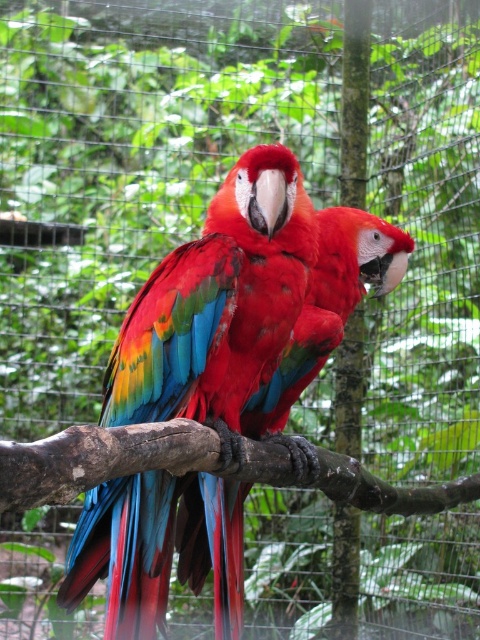
You are a zookeeper trying to determine if a new feeding tray can fit between the glossy feathers parrot at center and the brown rough tree branch at center. The feeding tray is 10 cm wide. Can you fit it there?

The glossy feathers parrot at center has a lesser width compared to brown rough tree branch at center. Since the parrot is narrower, the space between them may accommodate the 10 cm feeding tray, but exact placement depends on their positioning.

You are a zookeeper observing the aviary. You notice the glossy feathers parrot at center and the brown rough tree branch at center. Which object is positioned higher in the image?

The glossy feathers parrot at center is located above the brown rough tree branch at center, so it is positioned higher in the image.

Consider the image. You are a zookeeper observing the aviary. You notice the glossy feathers parrot at center and the brown rough tree branch at center. Which object is taller in the enclosure?

The glossy feathers parrot at center is taller than the brown rough tree branch at center.